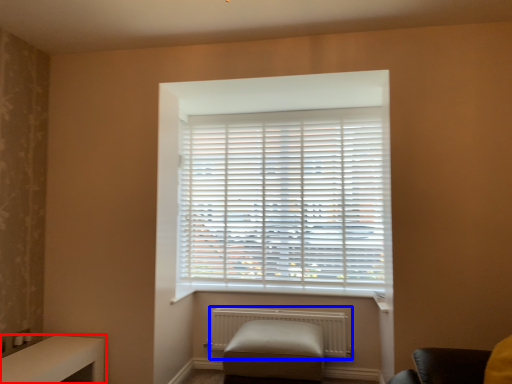
Question: Among these objects, which one is farthest to the camera, table (highlighted by a red box) or radiator (highlighted by a blue box)?

Choices:
 (A) table
 (B) radiator

Answer: (B)